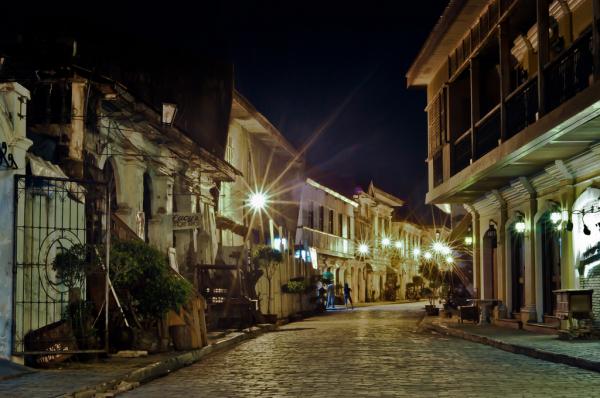
This screenshot has width=600, height=398. Find the location of `light bulb`. light bulb is located at coordinates (259, 197).